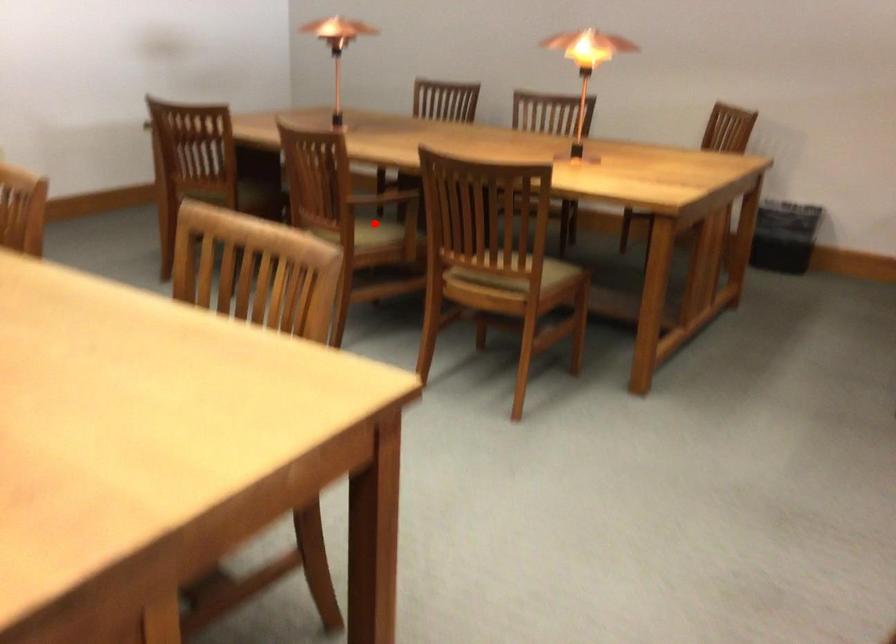
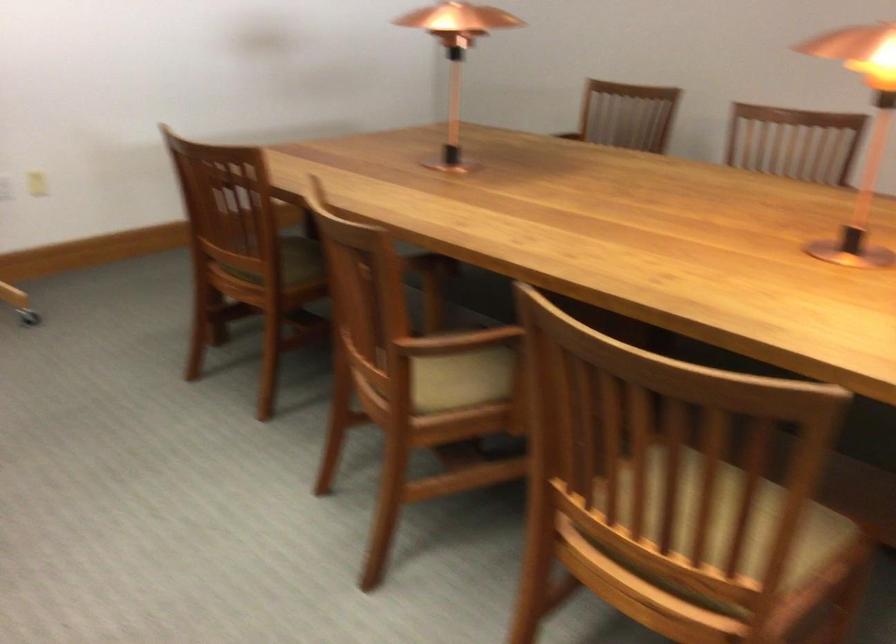
Question: I am providing you with two images of the same scene from different viewpoints. A red point is shown in image1. For the corresponding object point in image2, is it positioned nearer or farther from the camera?

Choices:
 (A) Nearer
 (B) Farther

Answer: (A)